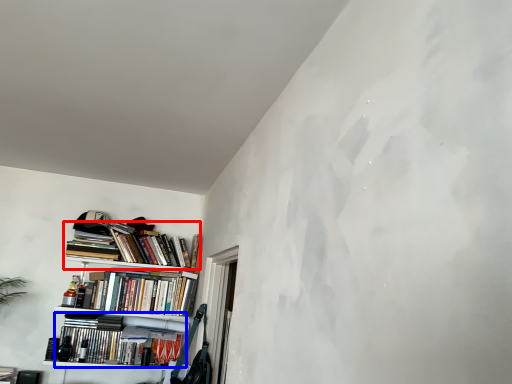
Question: Among these objects, which one is farthest to the camera, book (highlighted by a red box) or book (highlighted by a blue box)?

Choices:
 (A) book
 (B) book

Answer: (A)